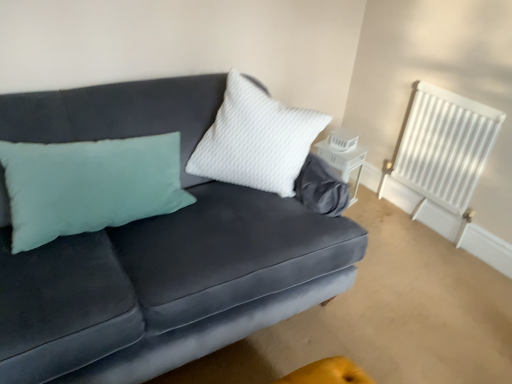
You are a GUI agent. You are given a task and a screenshot of the screen. Output one action in this format:
    pyautogui.click(x=<x>, y=<y>)
    Task: Click on the free point to the right of white matte lantern at center
    Image resolution: width=512 pixels, height=384 pixels.
    Given the screenshot: What is the action you would take?
    pyautogui.click(x=370, y=204)